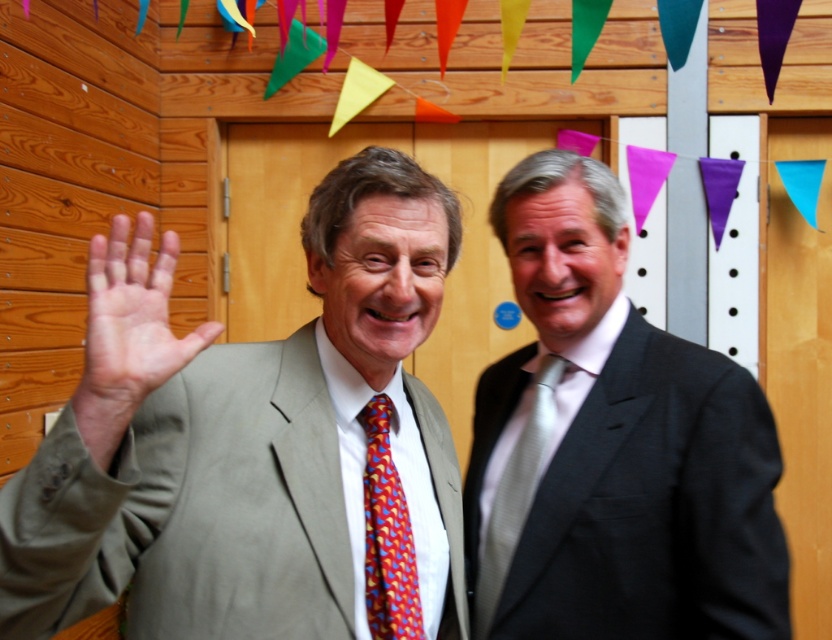
You are standing in the room and want to touch both points on the wall. Which point should you reach for first, the point at coordinate (x=281, y=362) or the point at coordinate (x=379, y=552)?

You should reach for point (x=281, y=362) first because it is closer to you than point (x=379, y=552), which is further away.

You are an interior designer observing the scene. You need to hang a picture frame between the matte gray suit at left and the multicolored silk tie at center. Based on their positions, where should you place the frame?

The matte gray suit at left is located above the multicolored silk tie at center, so the picture frame should be placed between them vertically, below the matte gray suit at left and above the multicolored silk tie at center.